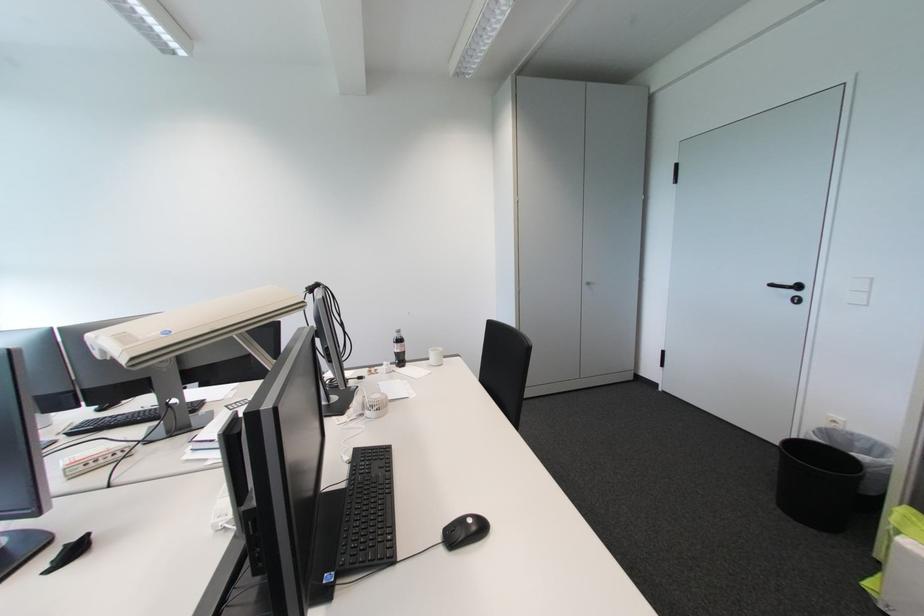
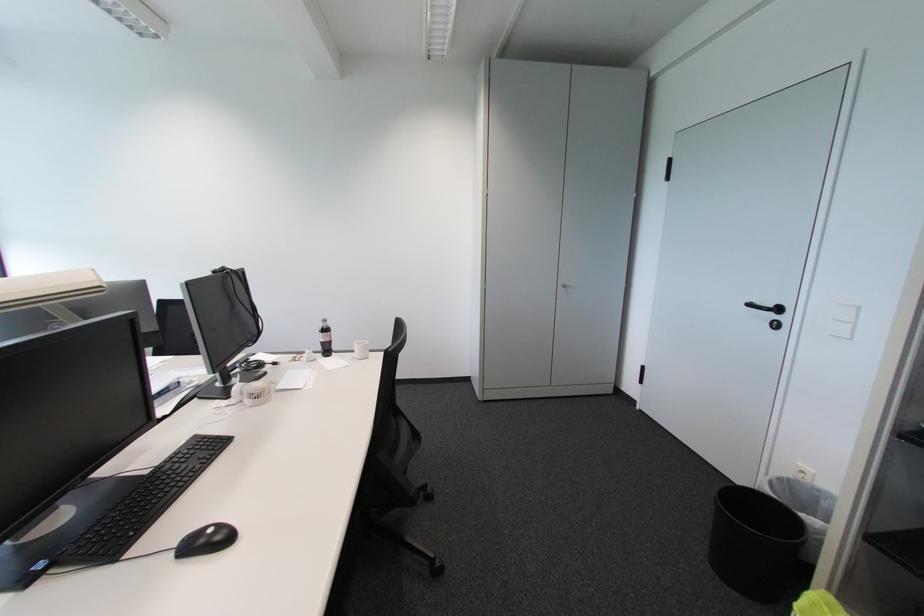
Find the pixel in the second image that matches (404,355) in the first image.

(330, 345)